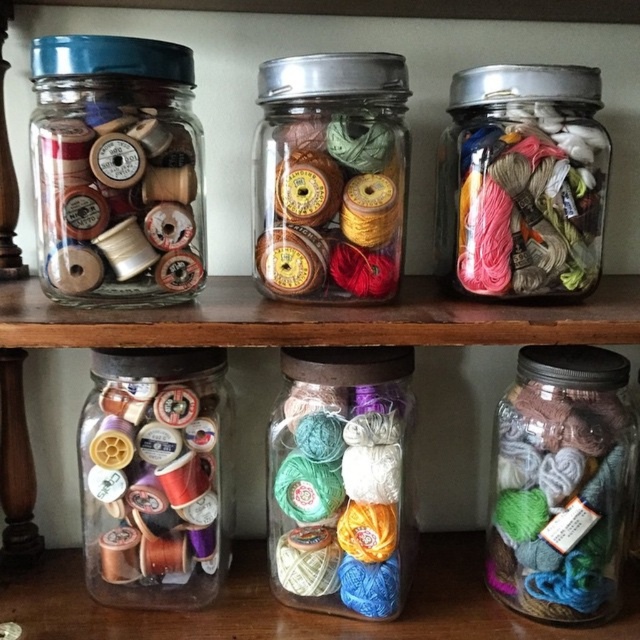
Question: Is matte plastic spools at upper left wider than metallic silver thread at upper right?

Choices:
 (A) no
 (B) yes

Answer: (B)

Question: Which object is the closest to the matte glass yarn balls at center?

Choices:
 (A) matte plastic spools at upper left
 (B) matte brown spools at center
 (C) multicolored yarn at center

Answer: (B)

Question: Which point appears farthest from the camera in this image?

Choices:
 (A) (346, 88)
 (B) (324, 497)
 (C) (580, 620)

Answer: (C)

Question: From the image, what is the correct spatial relationship of matte plastic spools at upper left in relation to multicolored yarn at center?

Choices:
 (A) left
 (B) right

Answer: (A)

Question: Which of the following is the closest to the observer?

Choices:
 (A) (193, 268)
 (B) (337, 260)

Answer: (A)

Question: Does matte glass yarn balls at center appear over multicolored yarn at center?

Choices:
 (A) yes
 (B) no

Answer: (A)